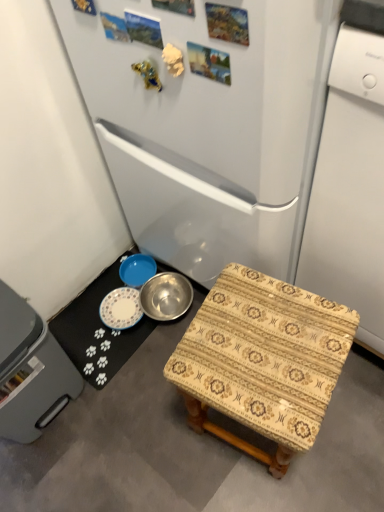
Where is `free spot below metallic silver bowl at lower center (from a real-world perspective)`? The width and height of the screenshot is (384, 512). free spot below metallic silver bowl at lower center (from a real-world perspective) is located at coordinates pos(97,325).